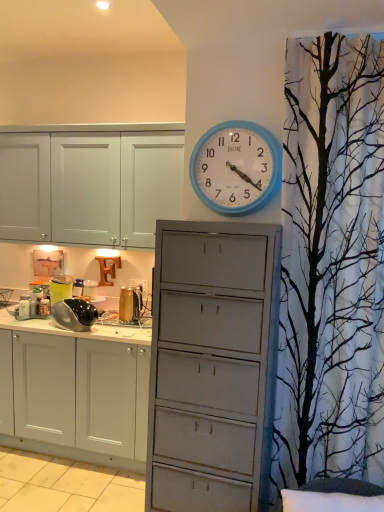
Question: Is the depth of black glossy kettle at left, acting as the second appliance starting from the left, greater than that of blue plastic wall clock at upper center?

Choices:
 (A) no
 (B) yes

Answer: (B)

Question: From a real-world perspective, is black glossy kettle at left, the 2th appliance in the right-to-left sequence, physically above blue plastic wall clock at upper center?

Choices:
 (A) no
 (B) yes

Answer: (A)

Question: Is black glossy kettle at left, the 2th appliance in the right-to-left sequence, smaller than blue plastic wall clock at upper center?

Choices:
 (A) no
 (B) yes

Answer: (A)

Question: Is blue plastic wall clock at upper center surrounded by black glossy kettle at left, the 2th appliance in the right-to-left sequence?

Choices:
 (A) yes
 (B) no

Answer: (B)

Question: Considering the relative sizes of black glossy kettle at left, the 2th appliance in the right-to-left sequence, and blue plastic wall clock at upper center in the image provided, is black glossy kettle at left, the 2th appliance in the right-to-left sequence, thinner than blue plastic wall clock at upper center?

Choices:
 (A) no
 (B) yes

Answer: (A)

Question: Considering the positions of metallic silver pot at left, the first appliance when ordered from left to right, and blue plastic wall clock at upper center in the image, is metallic silver pot at left, the first appliance when ordered from left to right, bigger or smaller than blue plastic wall clock at upper center?

Choices:
 (A) small
 (B) big

Answer: (A)

Question: Considering the positions of metallic silver pot at left, the first appliance when ordered from left to right, and blue plastic wall clock at upper center in the image, is metallic silver pot at left, the first appliance when ordered from left to right, taller or shorter than blue plastic wall clock at upper center?

Choices:
 (A) short
 (B) tall

Answer: (A)

Question: Considering their positions, is metallic silver pot at left, placed as the 3th appliance when sorted from right to left, located in front of or behind blue plastic wall clock at upper center?

Choices:
 (A) behind
 (B) front

Answer: (A)

Question: Based on their positions, is metallic silver pot at left, placed as the 3th appliance when sorted from right to left, located to the left or right of blue plastic wall clock at upper center?

Choices:
 (A) right
 (B) left

Answer: (B)

Question: From the image's perspective, is metallic silver pot at left, the first appliance when ordered from left to right, located above or below gold metallic kettle at center, placed as the 3th appliance when sorted from left to right?

Choices:
 (A) above
 (B) below

Answer: (A)

Question: From their relative heights in the image, would you say metallic silver pot at left, the first appliance when ordered from left to right, is taller or shorter than gold metallic kettle at center, acting as the 1th appliance starting from the right?

Choices:
 (A) short
 (B) tall

Answer: (B)

Question: Considering the positions of metallic silver pot at left, the first appliance when ordered from left to right, and gold metallic kettle at center, acting as the 1th appliance starting from the right, in the image, is metallic silver pot at left, the first appliance when ordered from left to right, bigger or smaller than gold metallic kettle at center, acting as the 1th appliance starting from the right,?

Choices:
 (A) big
 (B) small

Answer: (B)

Question: Is metallic silver pot at left, placed as the 3th appliance when sorted from right to left, wider or thinner than gold metallic kettle at center, acting as the 1th appliance starting from the right?

Choices:
 (A) wide
 (B) thin

Answer: (B)

Question: Considering their positions, is metallic silver pot at left, the first appliance when ordered from left to right, located in front of or behind black glossy kettle at left, acting as the second appliance starting from the left?

Choices:
 (A) behind
 (B) front

Answer: (A)

Question: Would you say metallic silver pot at left, the first appliance when ordered from left to right, is to the left or to the right of black glossy kettle at left, acting as the second appliance starting from the left, in the picture?

Choices:
 (A) left
 (B) right

Answer: (A)